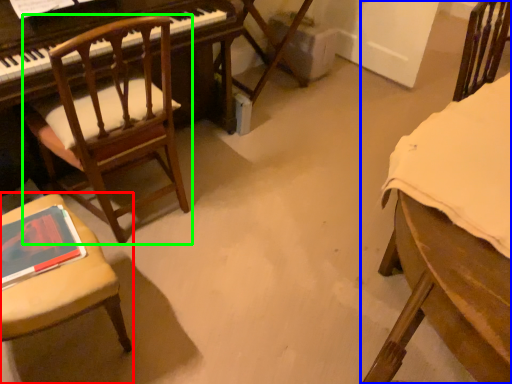
Question: Considering the real-world distances, which object is farthest from chair (highlighted by a red box)? chair (highlighted by a blue box) or chair (highlighted by a green box)?

Choices:
 (A) chair
 (B) chair

Answer: (A)